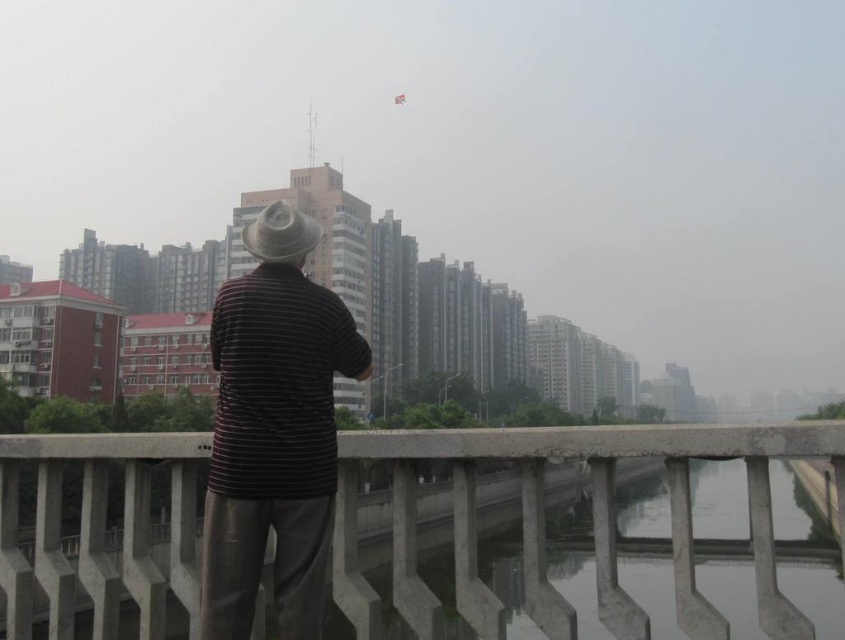
You are standing on the concrete bridge at center and want to hand an item to the striped cotton shirt at center. Can you reach them without moving from your current position?

The concrete bridge at center is in front of striped cotton shirt at center, meaning the shirt is behind the bridge. You cannot reach them without moving.

You are standing on the concrete bridge at center and looking up at the striped cotton shirt at center. Which object is closer to you?

The striped cotton shirt at center is closer to you because it is positioned above the concrete bridge at center.

You are standing on the concrete bridge at center. If you look directly ahead, what do you see in the scene?

You would see the body of water reflecting the surrounding buildings and sky, as described in the scene.